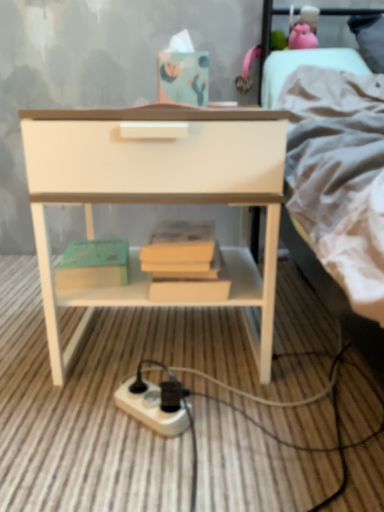
At what (x,y) coordinates should I click in order to perform the action: click on vacant space in front of white plastic power plugs and sockets at lower center. Please return your answer as a coordinate pair (x, y). The image size is (384, 512). Looking at the image, I should click on (139, 471).